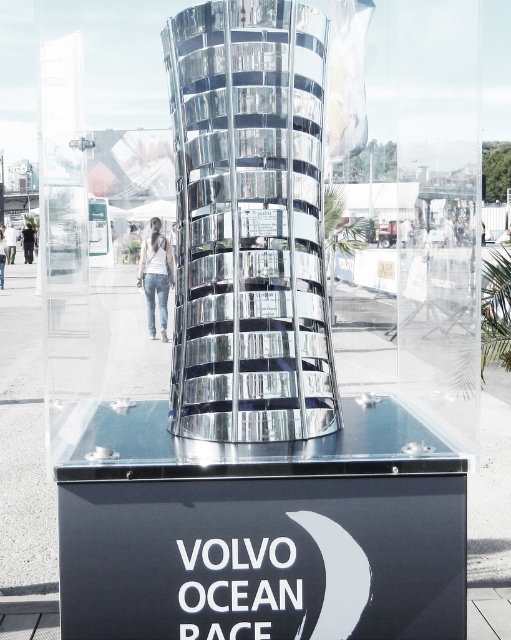
Question: Can you confirm if polished metallic trophy at center is smaller than shiny metallic tower at center?

Choices:
 (A) no
 (B) yes

Answer: (A)

Question: Which point is closer to the camera?

Choices:
 (A) (426, 3)
 (B) (313, 304)
 (C) (153, 310)

Answer: (B)

Question: Is shiny metallic tower at center behind denim jeans at center?

Choices:
 (A) yes
 (B) no

Answer: (B)

Question: Which is farther from the shiny metallic tower at center?

Choices:
 (A) polished metallic trophy at center
 (B) denim jeans at center

Answer: (B)

Question: Among these points, which one is farthest from the camera?

Choices:
 (A) (278, 209)
 (B) (53, 269)
 (C) (150, 269)

Answer: (B)

Question: Is polished metallic trophy at center further to the viewer compared to denim jeans at center?

Choices:
 (A) yes
 (B) no

Answer: (B)